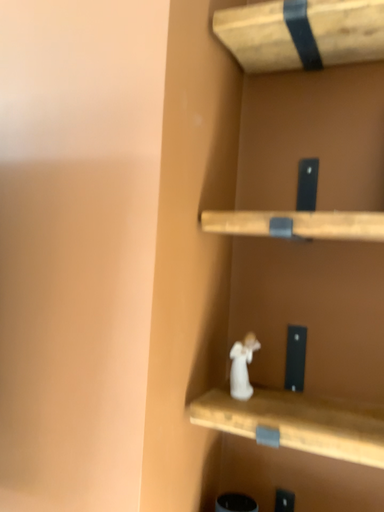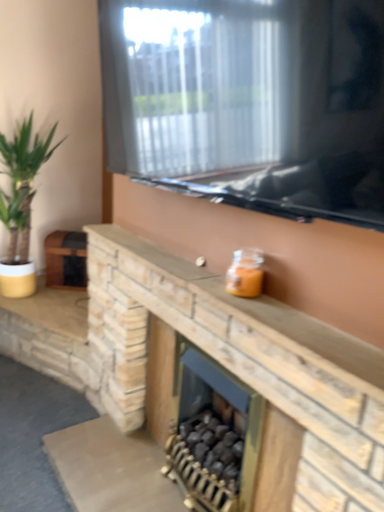
Question: Which way did the camera rotate in the video?

Choices:
 (A) rotated upward
 (B) rotated downward

Answer: (B)